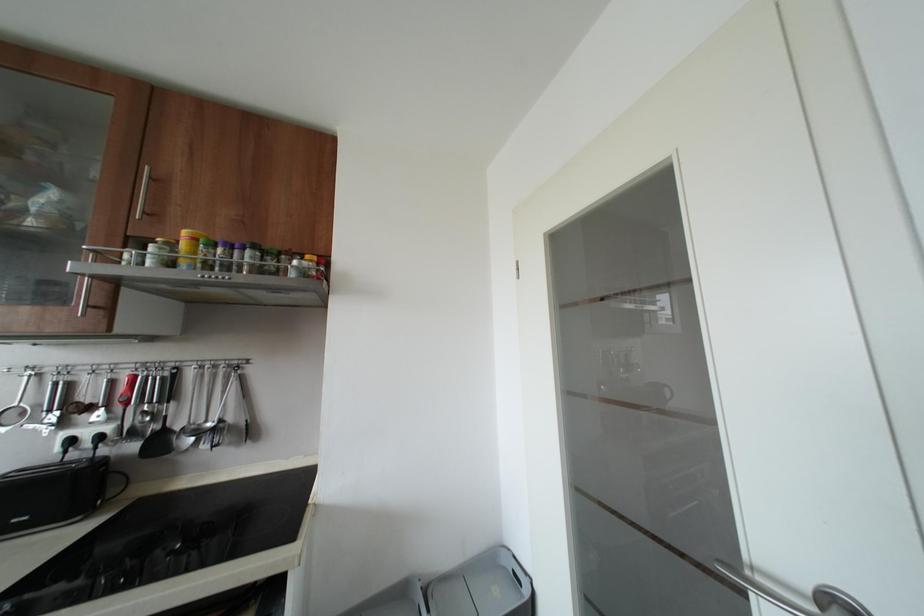
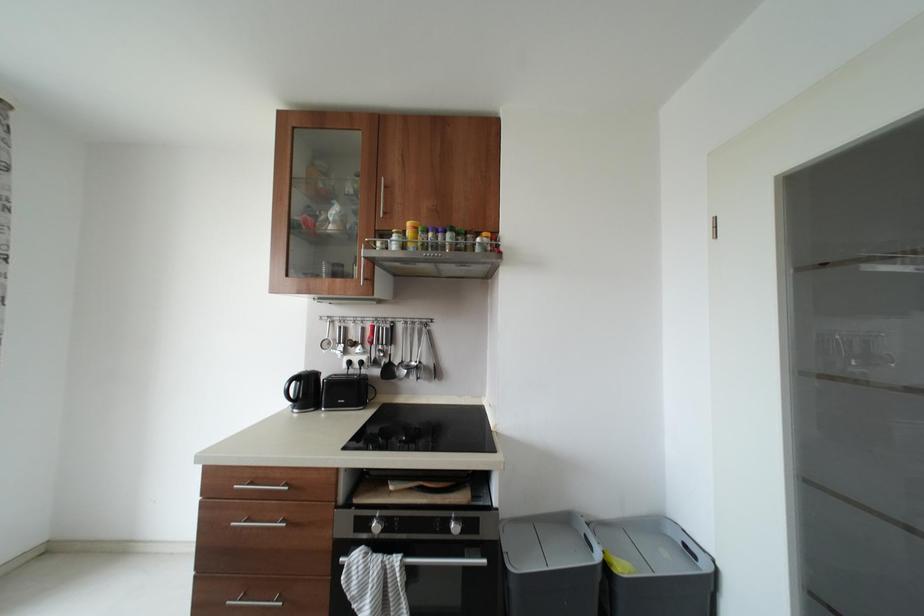
What movement of the cameraman would produce the second image?

The movement direction of the cameraman is left, backward.